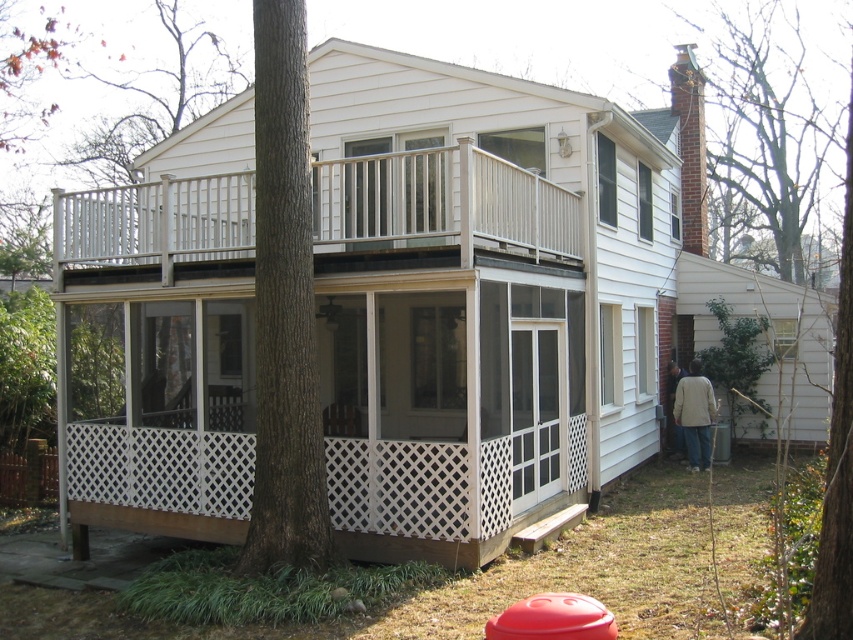
Between white wood porch at upper center and light beige jacket at lower right, which one appears on the left side from the viewer's perspective?

Positioned to the left is white wood porch at upper center.

In the scene shown: Does white wood porch at upper center have a lesser height compared to light beige jacket at lower right?

Correct, white wood porch at upper center is not as tall as light beige jacket at lower right.

Locate an element on the screen. white wood porch at upper center is located at coordinates (444, 202).

Locate an element on the screen. The image size is (853, 640). white wood porch at upper center is located at coordinates click(444, 202).

Is white wood porch at upper center further to the viewer compared to light brown jacket at lower right?

No, white wood porch at upper center is in front of light brown jacket at lower right.

The width and height of the screenshot is (853, 640). I want to click on white wood porch at upper center, so click(444, 202).

At what (x,y) coordinates should I click in order to perform the action: click on white wood porch at upper center. Please return your answer as a coordinate pair (x, y). The width and height of the screenshot is (853, 640). Looking at the image, I should click on (444, 202).

Which is more to the right, light beige jacket at lower right or light brown jacket at lower right?

light beige jacket at lower right

Looking at this image, which is more to the left, light beige jacket at lower right or light brown jacket at lower right?

light brown jacket at lower right

What are the coordinates of `light beige jacket at lower right` in the screenshot? It's located at (695, 413).

Locate an element on the screen. light beige jacket at lower right is located at coordinates (695, 413).